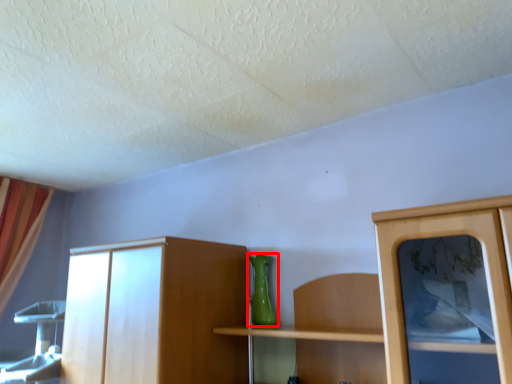
Question: From the image's perspective, what is the correct spatial relationship of vase (annotated by the red box) in relation to curtain?

Choices:
 (A) above
 (B) below

Answer: (A)